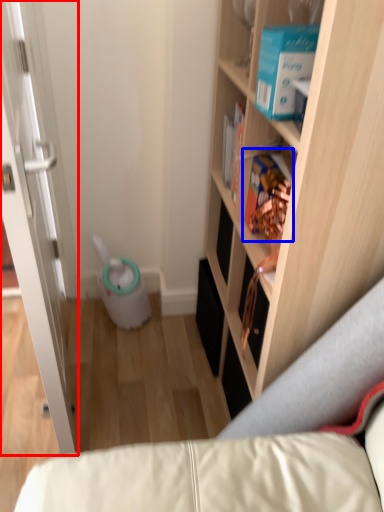
Question: Which point is further to the camera, door (highlighted by a red box) or book (highlighted by a blue box)?

Choices:
 (A) door
 (B) book

Answer: (B)